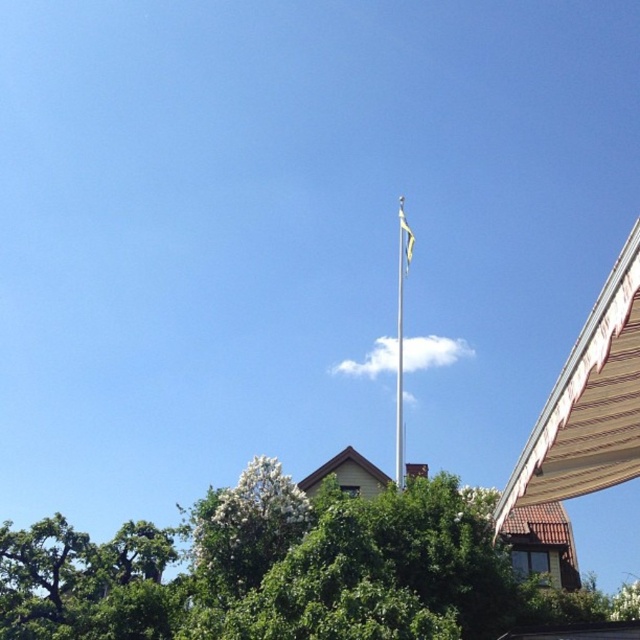
Can you confirm if yellow fabric flagpole at center is smaller than yellow fabric flag at upper center?

No.

Is point (396, 387) farther from camera compared to point (406, 224)?

That is False.

Image resolution: width=640 pixels, height=640 pixels. Find the location of `yellow fabric flagpole at center`. yellow fabric flagpole at center is located at coordinates (400, 339).

Which is behind, point (483, 538) or point (400, 365)?

Positioned behind is point (400, 365).

Can you confirm if green leafy tree at center is smaller than silver metallic flag pole at upper center?

Yes, green leafy tree at center is smaller than silver metallic flag pole at upper center.

Does point (436, 592) come in front of point (400, 298)?

Yes.

I want to click on green leafy tree at center, so click(x=280, y=570).

Between point (401, 307) and point (404, 246), which one is positioned in front?

Point (401, 307)

Does silver metallic flag pole at upper center come in front of yellow fabric flag at upper center?

Yes.

What do you see at coordinates (401, 330) in the screenshot? I see `silver metallic flag pole at upper center` at bounding box center [401, 330].

Find the location of a particular element. Image resolution: width=640 pixels, height=640 pixels. silver metallic flag pole at upper center is located at coordinates (401, 330).